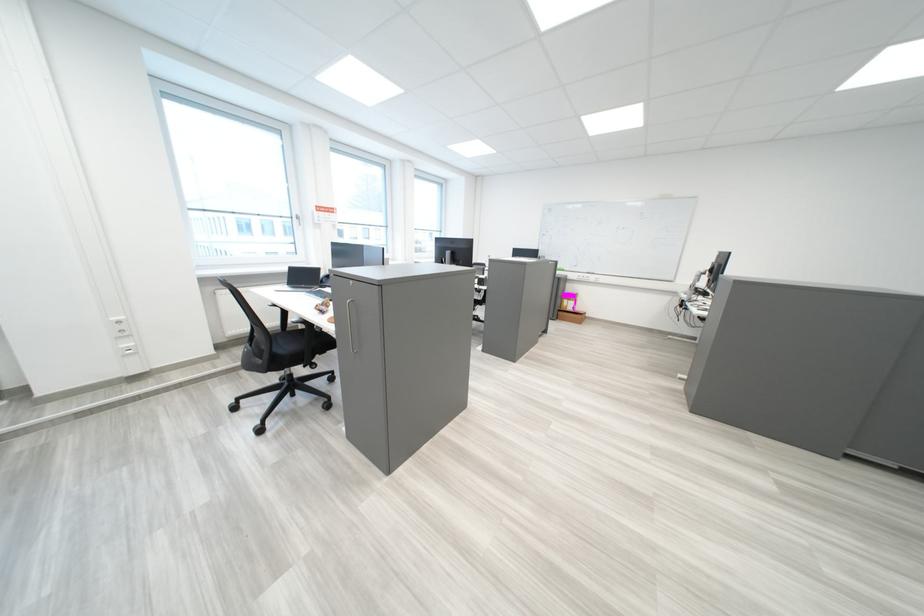
What do you see at coordinates (349, 326) in the screenshot? This screenshot has width=924, height=616. I see `a gray cabinet handle` at bounding box center [349, 326].